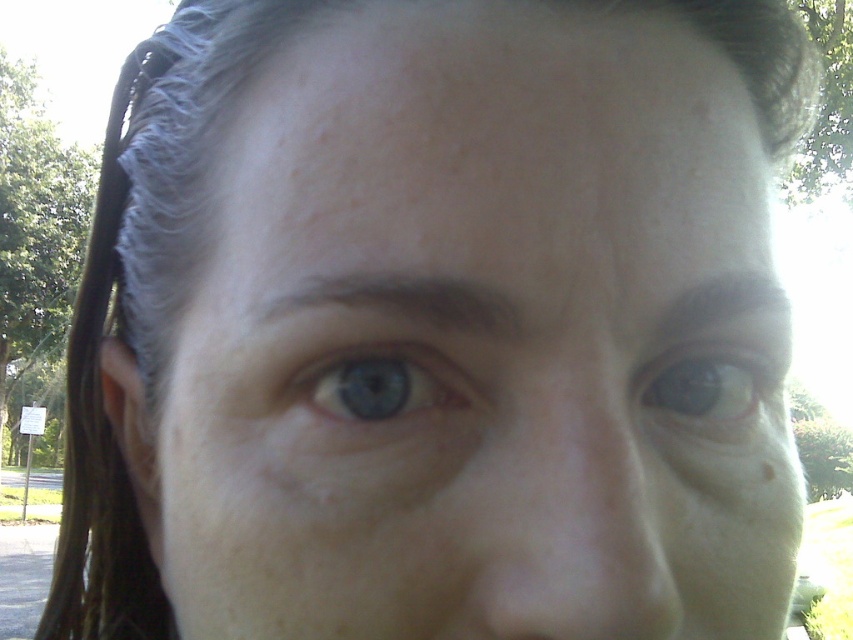
Question: Estimate the real-world distances between objects in this image. Which object is farther from the smooth skin face at center?

Choices:
 (A) blue matte eye at upper center
 (B) blue matte eye at center

Answer: (A)

Question: Which point is farther to the camera?

Choices:
 (A) blue matte eye at center
 (B) blue matte eye at upper center
 (C) smooth skin face at center

Answer: (B)

Question: Can you confirm if blue matte eye at upper center is thinner than blue matte eye at center?

Choices:
 (A) yes
 (B) no

Answer: (B)

Question: Estimate the real-world distances between objects in this image. Which object is closer to the blue matte eye at center?

Choices:
 (A) smooth skin face at center
 (B) blue matte eye at upper center

Answer: (A)

Question: Is blue matte eye at upper center to the left of blue matte eye at center from the viewer's perspective?

Choices:
 (A) no
 (B) yes

Answer: (A)

Question: Does blue matte eye at upper center have a lesser width compared to blue matte eye at center?

Choices:
 (A) yes
 (B) no

Answer: (B)